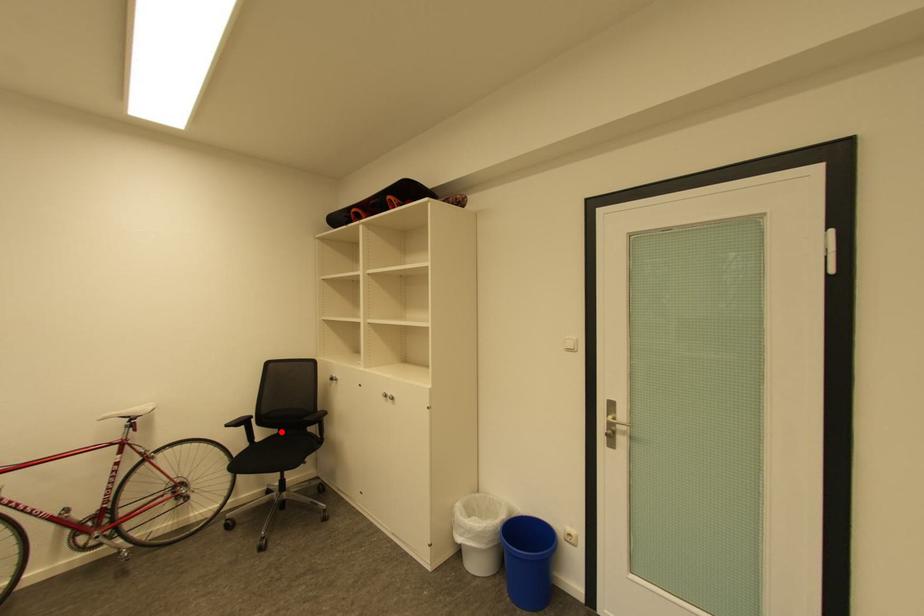
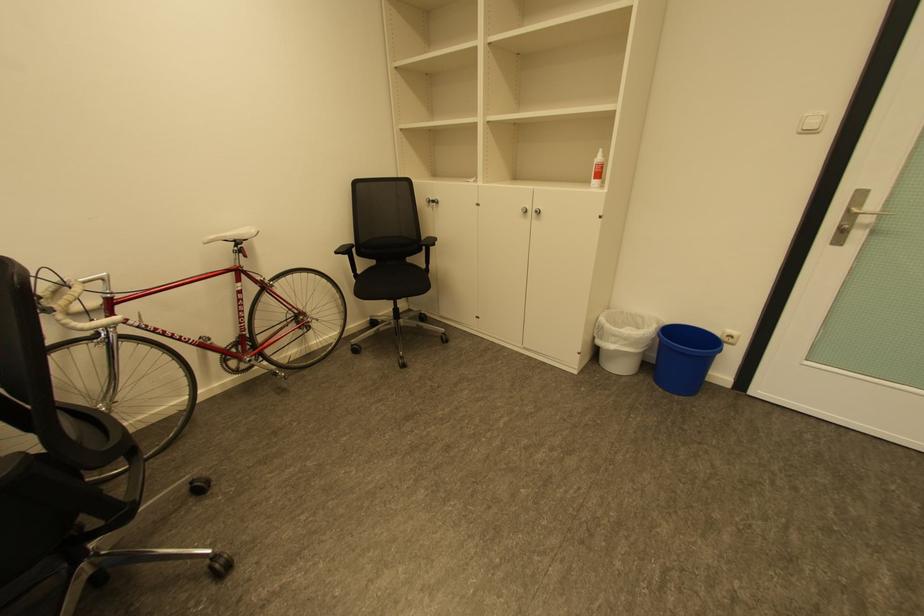
Question: I am providing you with two images of the same scene from different viewpoints. Image1 has a red point marked. In image2, the corresponding 3D location appears at what relative position? Reply with the corresponding letter.

Choices:
 (A) Closer
 (B) Farther

Answer: (A)